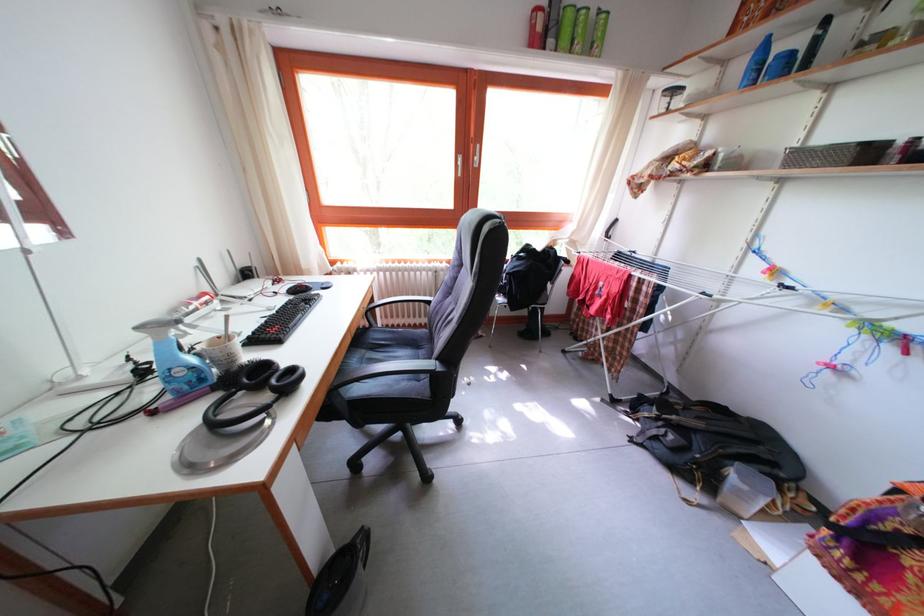
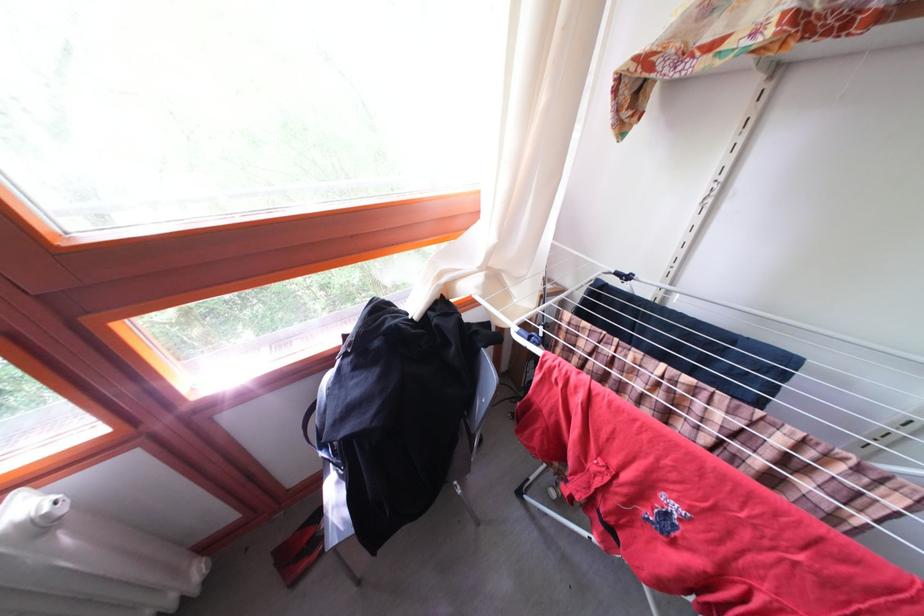
What movement of the cameraman would produce the second image?

The movement direction of the cameraman is right, forward.